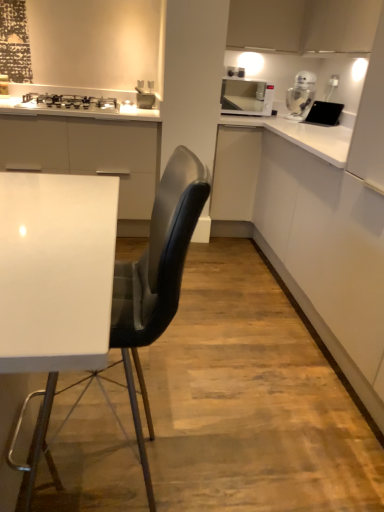
Question: From a real-world perspective, is black leather chair at center physically located above or below black matte tablet at upper right?

Choices:
 (A) below
 (B) above

Answer: (A)

Question: Visually, is black leather chair at center positioned to the left or to the right of black matte tablet at upper right?

Choices:
 (A) right
 (B) left

Answer: (B)

Question: Which object is the closest to the black matte tablet at upper right?

Choices:
 (A) matte white cabinet at upper right
 (B) black leather chair at center
 (C) clear glass jar at upper right
 (D) silver metallic gas stove at upper left
 (E) white glossy microwave at upper right

Answer: (C)

Question: Considering the real-world distances, which object is farthest from the silver metallic gas stove at upper left?

Choices:
 (A) black leather chair at center
 (B) matte white cabinet at upper right
 (C) white glossy microwave at upper right
 (D) black matte tablet at upper right
 (E) clear glass jar at upper right

Answer: (A)